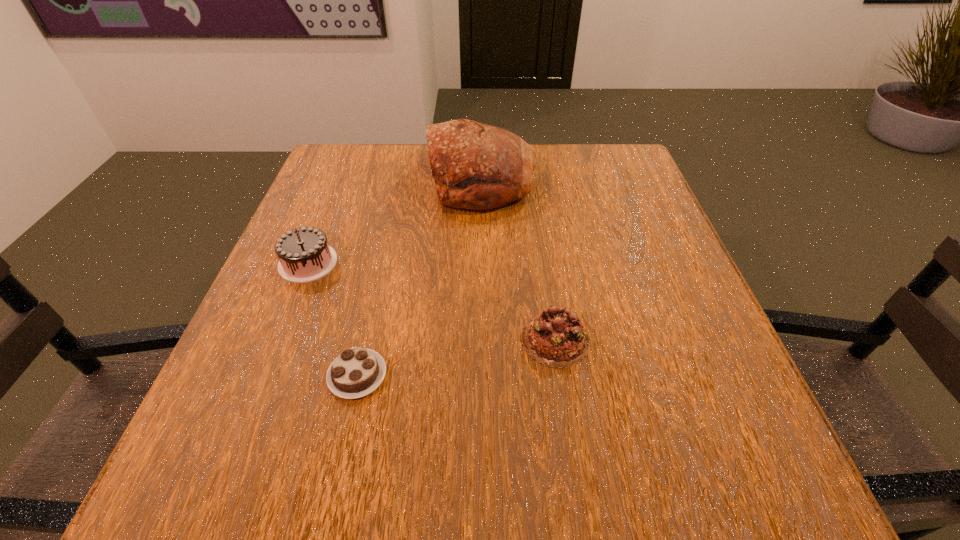
Where is `vacant point located between the second chocolate cake from right to left and the tallest object`? The height and width of the screenshot is (540, 960). vacant point located between the second chocolate cake from right to left and the tallest object is located at coordinates (420, 278).

At what (x,y) coordinates should I click in order to perform the action: click on empty space that is in between the second shortest object and the tallest object. Please return your answer as a coordinate pair (x, y). The height and width of the screenshot is (540, 960). Looking at the image, I should click on (518, 260).

Where is `free space between the second chocolate cake from right to left and the tallest object`? Image resolution: width=960 pixels, height=540 pixels. free space between the second chocolate cake from right to left and the tallest object is located at coordinates (420, 278).

Locate which object is the closest to the tallest object. Please provide its 2D coordinates. Your answer should be formatted as a tuple, i.e. [(x, y)], where the tuple contains the x and y coordinates of a point satisfying the conditions above.

[(304, 255)]

The width and height of the screenshot is (960, 540). I want to click on the closest object to the shortest object, so click(x=304, y=255).

Locate which chocolate cake ranks in proximity to the shortest object. Please provide its 2D coordinates. Your answer should be formatted as a tuple, i.e. [(x, y)], where the tuple contains the x and y coordinates of a point satisfying the conditions above.

[(304, 255)]

Identify the location of the second closest chocolate cake to the third object from right to left. (556, 338).

Locate an element on the screen. vacant point that satisfies the following two spatial constraints: 1. at the sliced front of the bread; 2. on the left side of the second shortest chocolate cake is located at coordinates (482, 340).

This screenshot has height=540, width=960. Find the location of `free space that satisfies the following two spatial constraints: 1. on the front side of the leftmost object; 2. on the left side of the third tallest object`. free space that satisfies the following two spatial constraints: 1. on the front side of the leftmost object; 2. on the left side of the third tallest object is located at coordinates (277, 340).

Identify the location of vacant space that satisfies the following two spatial constraints: 1. at the sliced front of the rightmost chocolate cake; 2. on the left side of the farthest object. The height and width of the screenshot is (540, 960). (482, 340).